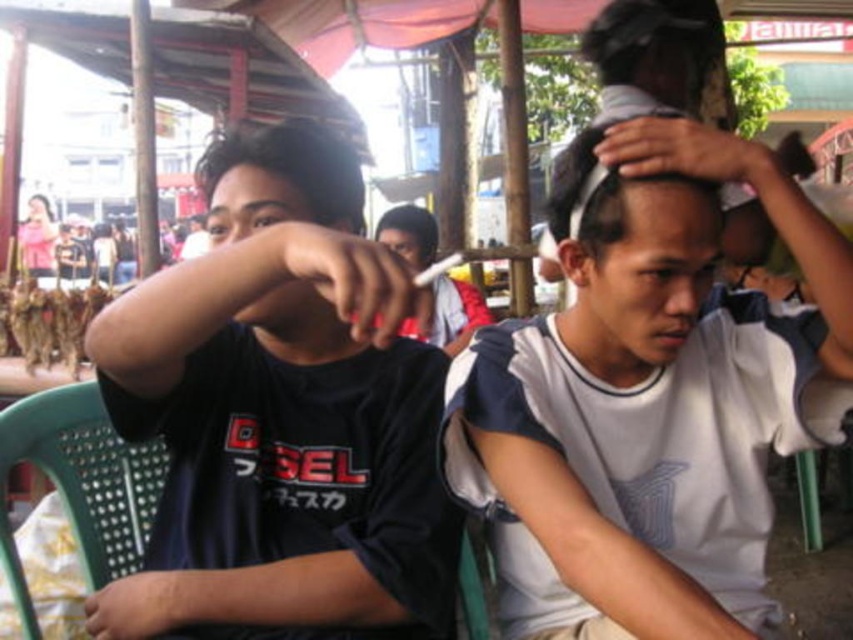
Is point (279, 316) behind point (613, 189)?

Yes, point (279, 316) is farther from viewer.

How distant is black matte shirt at left from white matte head at center?

They are 13.48 inches apart.

Image resolution: width=853 pixels, height=640 pixels. What do you see at coordinates (282, 417) in the screenshot?
I see `black matte shirt at left` at bounding box center [282, 417].

Where is `black matte shirt at left`? The height and width of the screenshot is (640, 853). black matte shirt at left is located at coordinates (282, 417).

Between black matte shirt at left and green plastic chair at lower left, which one is positioned lower?

green plastic chair at lower left

The width and height of the screenshot is (853, 640). What do you see at coordinates (282, 417) in the screenshot?
I see `black matte shirt at left` at bounding box center [282, 417].

Is point (431, 483) positioned behind point (28, 461)?

No, (431, 483) is closer to viewer.

In order to click on black matte shirt at left in this screenshot , I will do `click(282, 417)`.

Which is above, green plastic chair at lower left or dark brown hair at upper left?

Positioned higher is dark brown hair at upper left.

Who is positioned more to the left, green plastic chair at lower left or dark brown hair at upper left?

From the viewer's perspective, green plastic chair at lower left appears more on the left side.

Describe the element at coordinates (80, 483) in the screenshot. I see `green plastic chair at lower left` at that location.

Locate an element on the screen. green plastic chair at lower left is located at coordinates (80, 483).